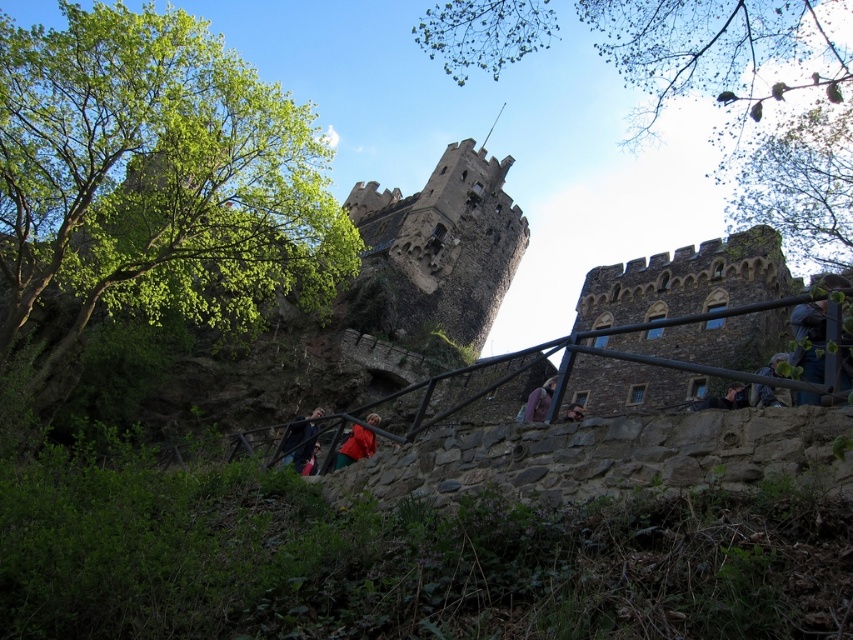
Question: Which point is closer to the camera taking this photo?

Choices:
 (A) (289, 444)
 (B) (346, 440)
 (C) (770, 404)
 (D) (497, 204)

Answer: (C)

Question: Can you confirm if green fabric jacket at lower right is thinner than dark blue jacket at center?

Choices:
 (A) yes
 (B) no

Answer: (B)

Question: Is green fabric jacket at lower right smaller than purple fabric at center?

Choices:
 (A) no
 (B) yes

Answer: (B)

Question: Is stone tower at center below purple fabric at center?

Choices:
 (A) yes
 (B) no

Answer: (B)

Question: Which of the following is the farthest from the observer?

Choices:
 (A) dark blue fabric jacket at lower center
 (B) dark blue jacket at center
 (C) green fabric jacket at lower right
 (D) red fabric jacket at lower center

Answer: (B)

Question: Which object is farther from the camera taking this photo?

Choices:
 (A) red fabric jacket at lower center
 (B) dark blue jacket at center
 (C) purple fabric at center
 (D) stone tower at center

Answer: (D)